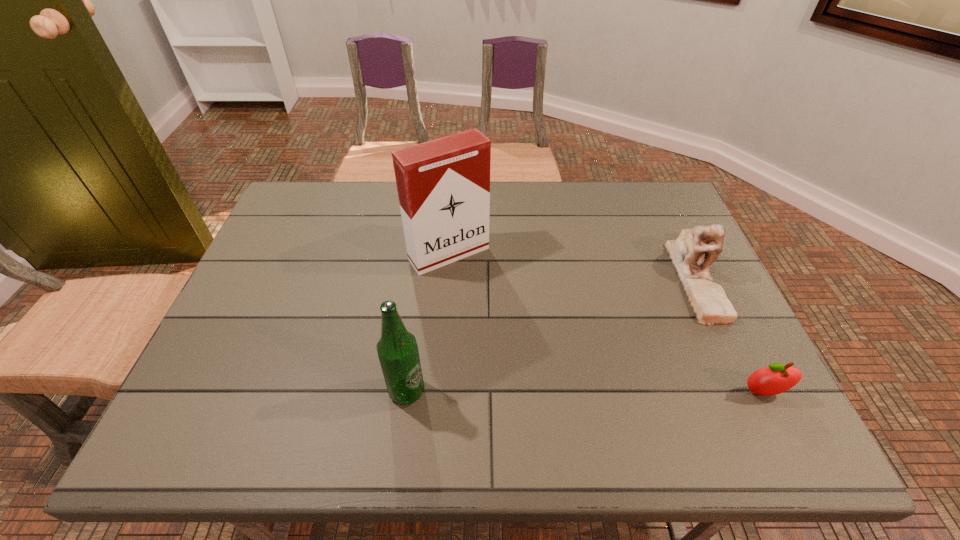
Where is `free space on the desktop that is between the beer bottle and the apple and is positioned on the front-facing side of the second shortest object`? Image resolution: width=960 pixels, height=540 pixels. free space on the desktop that is between the beer bottle and the apple and is positioned on the front-facing side of the second shortest object is located at coordinates (596, 392).

Where is `free space on the desktop that is between the beer bottle and the shortest object and is positioned on the front-facing side of the cigarette_case`? The image size is (960, 540). free space on the desktop that is between the beer bottle and the shortest object and is positioned on the front-facing side of the cigarette_case is located at coordinates (555, 392).